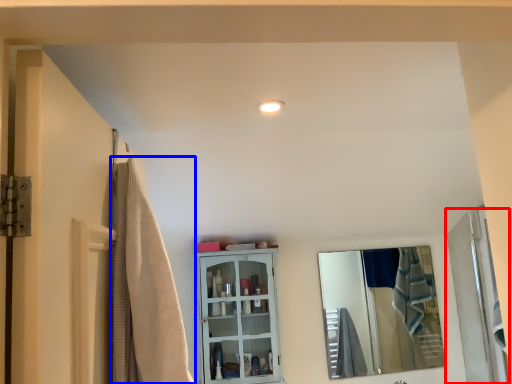
Question: Which object is closer to the camera taking this photo, door (highlighted by a red box) or shower curtain (highlighted by a blue box)?

Choices:
 (A) door
 (B) shower curtain

Answer: (B)